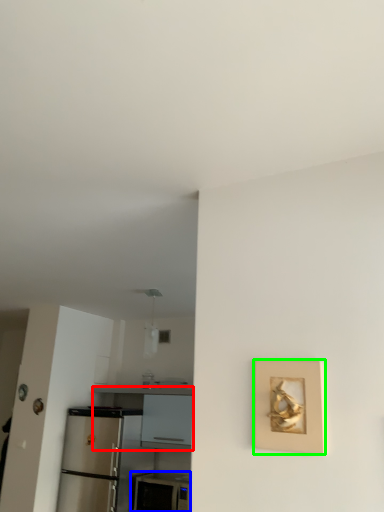
Question: Which object is positioned closest to counter (highlighted by a red box)? Select from appliance (highlighted by a blue box) and picture frame (highlighted by a green box).

Choices:
 (A) appliance
 (B) picture frame

Answer: (A)